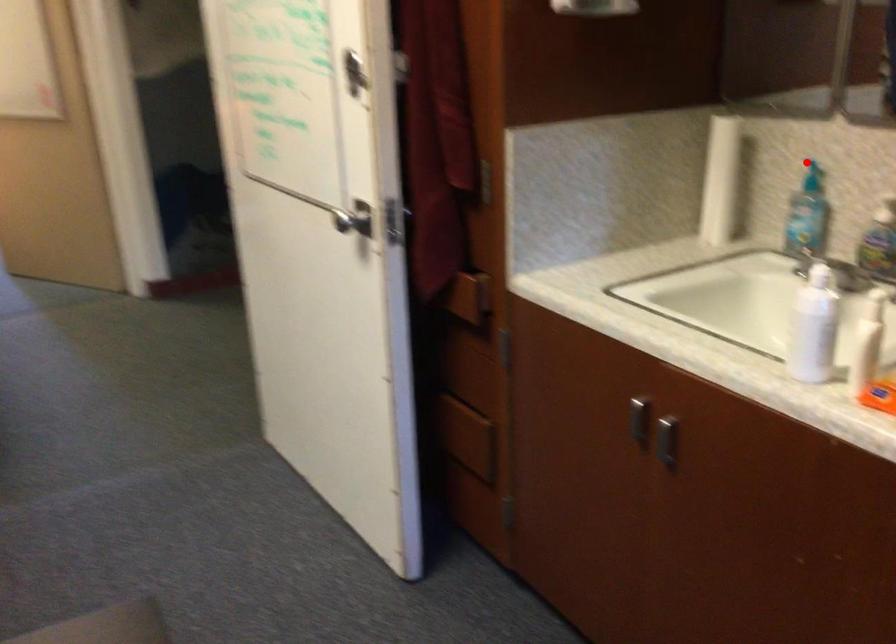
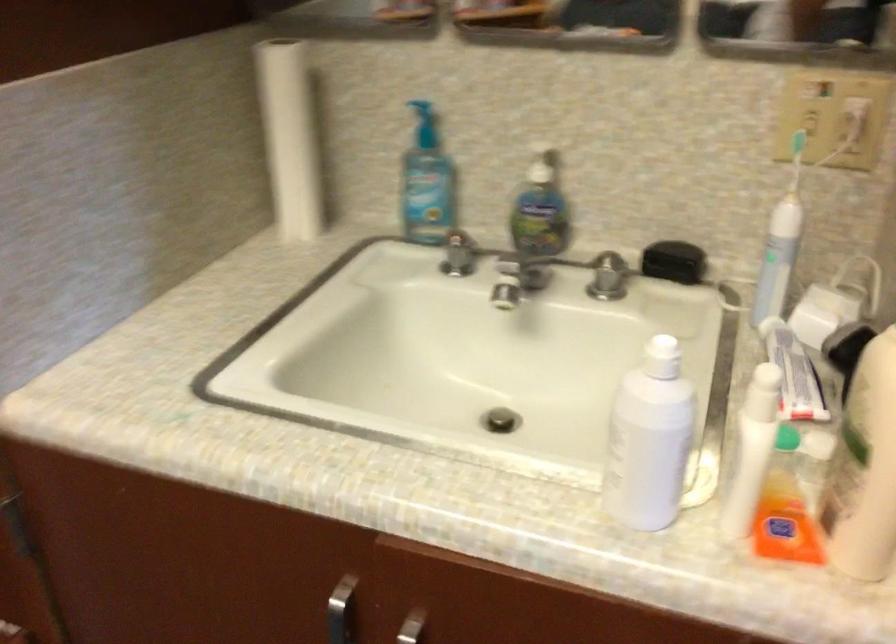
Question: I am providing you with two images of the same scene from different viewpoints. Given a red point in image1, look at the same physical point in image2. Is it:

Choices:
 (A) Closer to the viewpoint
 (B) Farther from the viewpoint

Answer: (A)